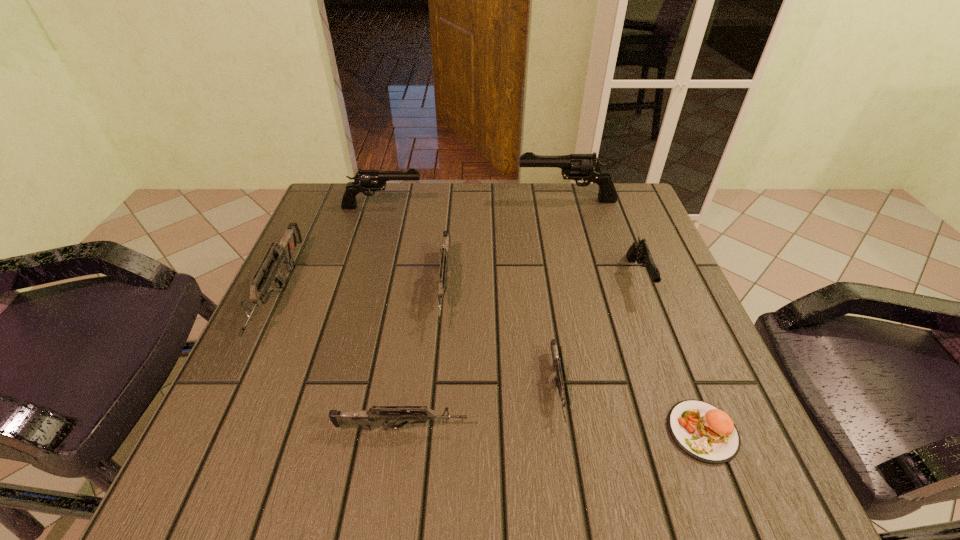
You are a GUI agent. You are given a task and a screenshot of the screen. Output one action in this format:
    pyautogui.click(x=<x>, y=<y>)
    Task: Click on the vacant space that is in between the third smallest grey gun and the second shortest gun
    
    Given the screenshot: What is the action you would take?
    pyautogui.click(x=423, y=359)

Find the location of a particular element. The image size is (960, 540). free space between the patty and the second shortest gun is located at coordinates (552, 430).

Find the location of `free spot between the second smallest grey gun and the leftmost object`. free spot between the second smallest grey gun and the leftmost object is located at coordinates (341, 361).

The width and height of the screenshot is (960, 540). I want to click on free spot between the second biggest grey gun and the tallest gun, so click(x=506, y=245).

Choose which object is the third nearest neighbor to the third biggest grey gun. Please provide its 2D coordinates. Your answer should be formatted as a tuple, i.e. [(x, y)], where the tuple contains the x and y coordinates of a point satisfying the conditions above.

[(282, 252)]

At what (x,y) coordinates should I click in order to perform the action: click on object that ranks as the closest to the second shortest gun. Please return your answer as a coordinate pair (x, y). This screenshot has width=960, height=540. Looking at the image, I should click on (559, 383).

The height and width of the screenshot is (540, 960). I want to click on gun that is the fourth closest to the shortest gun, so click(x=587, y=167).

Identify which gun is the sixth nearest to the sixth tallest object. Please provide its 2D coordinates. Your answer should be formatted as a tuple, i.e. [(x, y)], where the tuple contains the x and y coordinates of a point satisfying the conditions above.

[(587, 167)]

Find the location of a particular element. the closest black gun to the smallest grey gun is located at coordinates (638, 251).

This screenshot has height=540, width=960. I want to click on black gun that stands as the third closest to the leftmost gun, so click(x=638, y=251).